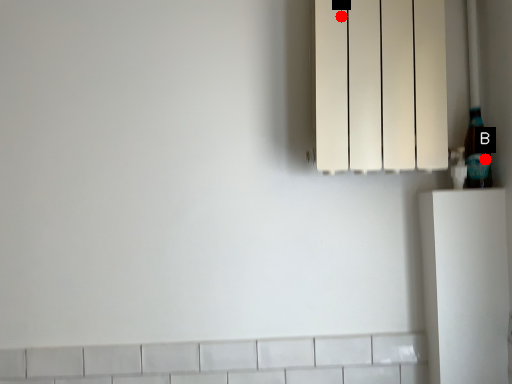
Question: Two points are circled on the image, labeled by A and B beside each circle. Which point is farther from the camera taking this photo?

Choices:
 (A) A is further
 (B) B is further

Answer: (B)